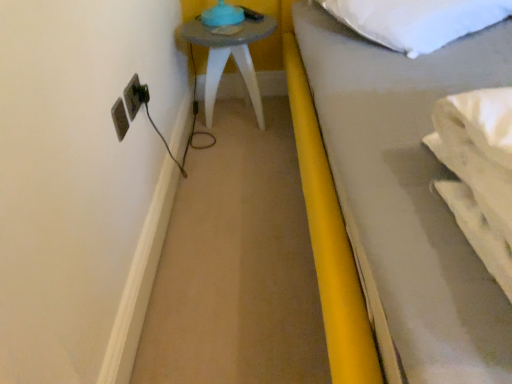
Question: Does white soft pillow at upper right come in front of matte plastic electrical outlet at left?

Choices:
 (A) yes
 (B) no

Answer: (A)

Question: Can you confirm if white soft pillow at upper right is smaller than matte plastic electrical outlet at left?

Choices:
 (A) no
 (B) yes

Answer: (A)

Question: Considering the relative sizes of white soft pillow at upper right and matte plastic electrical outlet at left in the image provided, is white soft pillow at upper right taller than matte plastic electrical outlet at left?

Choices:
 (A) yes
 (B) no

Answer: (A)

Question: Considering the relative sizes of white soft pillow at upper right and matte plastic electrical outlet at left in the image provided, is white soft pillow at upper right shorter than matte plastic electrical outlet at left?

Choices:
 (A) no
 (B) yes

Answer: (A)

Question: Is white soft pillow at upper right aimed at matte plastic electrical outlet at left?

Choices:
 (A) no
 (B) yes

Answer: (A)

Question: Is white soft pillow at upper right in contact with matte plastic electrical outlet at left?

Choices:
 (A) no
 (B) yes

Answer: (A)

Question: From a real-world perspective, is matte plastic electrical outlet at left physically below matte gray side table at upper left?

Choices:
 (A) no
 (B) yes

Answer: (A)

Question: Is the position of matte plastic electrical outlet at left less distant than that of matte gray side table at upper left?

Choices:
 (A) yes
 (B) no

Answer: (A)

Question: Can you confirm if matte plastic electrical outlet at left is taller than matte gray side table at upper left?

Choices:
 (A) no
 (B) yes

Answer: (A)

Question: From the image's perspective, is matte plastic electrical outlet at left under matte gray side table at upper left?

Choices:
 (A) no
 (B) yes

Answer: (B)

Question: Can you confirm if matte plastic electrical outlet at left is smaller than matte gray side table at upper left?

Choices:
 (A) yes
 (B) no

Answer: (A)

Question: Are matte plastic electrical outlet at left and matte gray side table at upper left far apart?

Choices:
 (A) no
 (B) yes

Answer: (A)

Question: Can you confirm if matte gray side table at upper left is shorter than matte plastic electrical outlet at left?

Choices:
 (A) no
 (B) yes

Answer: (A)